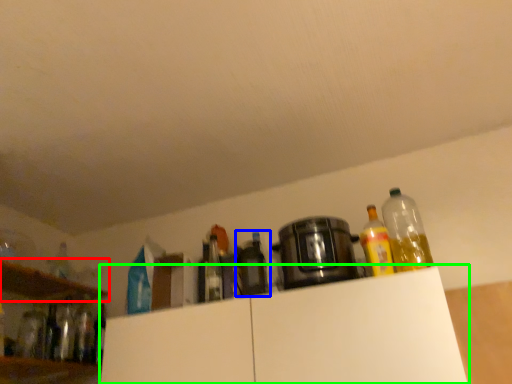
Question: Estimate the real-world distances between objects in this image. Which object is closer to shelf (highlighted by a red box), bottle (highlighted by a blue box) or cabinetry (highlighted by a green box)?

Choices:
 (A) bottle
 (B) cabinetry

Answer: (B)